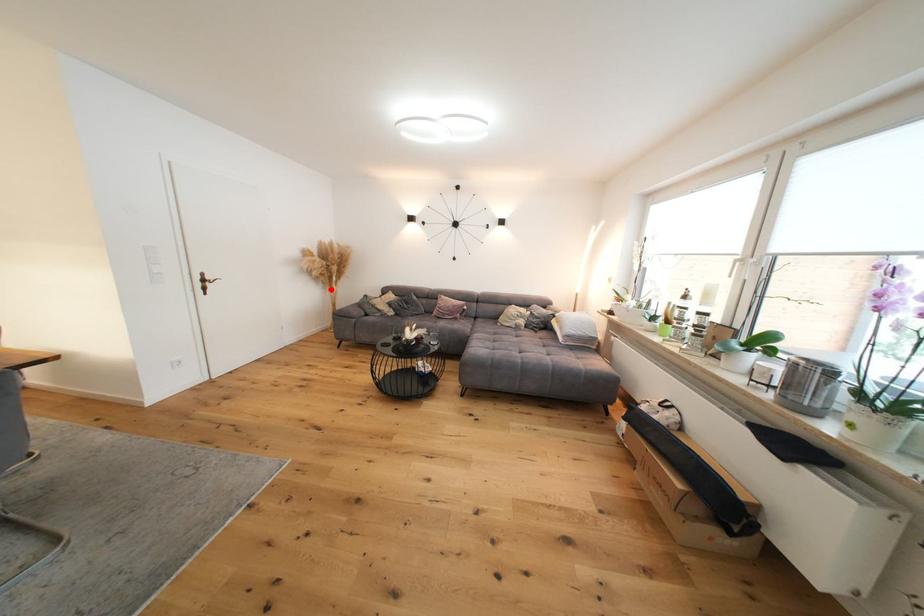
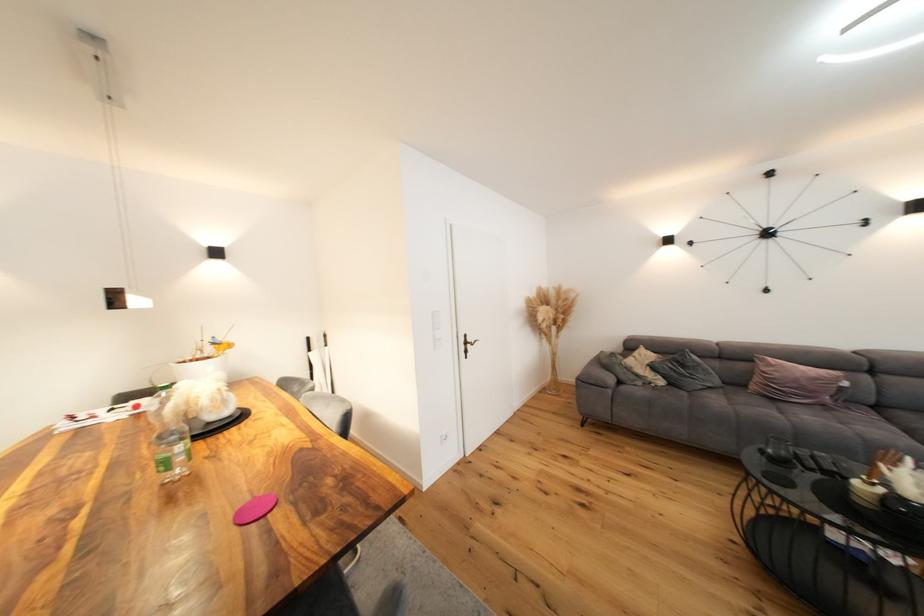
Question: I am providing you with two images of the same scene from different viewpoints. A red point is marked on the first image. Can you still see the location of the red point in image 2?

Choices:
 (A) Yes
 (B) No

Answer: (A)